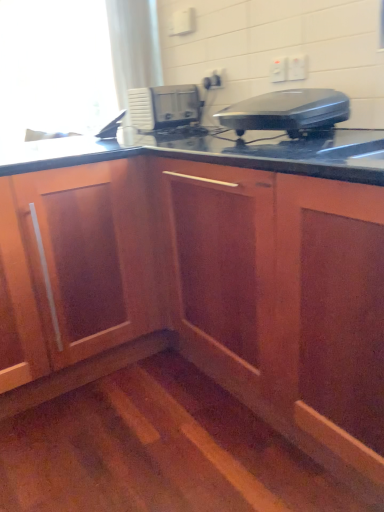
Question: Does white plastic electric outlet at upper right, the first electric outlet viewed from the front, appear on the left side of black plastic toaster at upper right, which appears as the 2th home appliance when viewed from the top?

Choices:
 (A) yes
 (B) no

Answer: (B)

Question: Would you consider white plastic electric outlet at upper right, the third electric outlet when ordered from back to front, to be distant from black plastic toaster at upper right, which ranks as the 2th home appliance in back-to-front order?

Choices:
 (A) no
 (B) yes

Answer: (A)

Question: Considering the relative positions of white plastic electric outlet at upper right, the first electric outlet viewed from the front, and black plastic toaster at upper right, which appears as the 2th home appliance when viewed from the top, in the image provided, is white plastic electric outlet at upper right, the first electric outlet viewed from the front, to the right of black plastic toaster at upper right, which appears as the 2th home appliance when viewed from the top, from the viewer's perspective?

Choices:
 (A) yes
 (B) no

Answer: (A)

Question: Is white plastic electric outlet at upper right, the 3th electric outlet from the left, smaller than black plastic toaster at upper right, which is the first home appliance in front-to-back order?

Choices:
 (A) no
 (B) yes

Answer: (B)

Question: From a real-world perspective, is white plastic electric outlet at upper right, the 3th electric outlet from the left, located higher than black plastic toaster at upper right, which ranks as the 2th home appliance in back-to-front order?

Choices:
 (A) no
 (B) yes

Answer: (B)

Question: Considering the relative positions of white plastic electric outlet at upper right, the first electric outlet viewed from the right, and black plastic toaster at upper right, which appears as the 2th home appliance when viewed from the top, in the image provided, is white plastic electric outlet at upper right, the first electric outlet viewed from the right, in front of black plastic toaster at upper right, which appears as the 2th home appliance when viewed from the top,?

Choices:
 (A) no
 (B) yes

Answer: (A)

Question: From the image's perspective, is wooden cabinet at center below black plastic toaster at upper right, which appears as the 2th home appliance when viewed from the left?

Choices:
 (A) yes
 (B) no

Answer: (A)

Question: Is wooden cabinet at center thinner than black plastic toaster at upper right, which appears as the 2th home appliance when viewed from the left?

Choices:
 (A) yes
 (B) no

Answer: (B)

Question: From a real-world perspective, does wooden cabinet at center sit lower than black plastic toaster at upper right, which appears as the 2th home appliance when viewed from the left?

Choices:
 (A) no
 (B) yes

Answer: (B)

Question: Is wooden cabinet at center far from black plastic toaster at upper right, which ranks as the 2th home appliance in back-to-front order?

Choices:
 (A) no
 (B) yes

Answer: (A)

Question: Considering the relative sizes of wooden cabinet at center and black plastic toaster at upper right, which is counted as the 1th home appliance, starting from the bottom, in the image provided, is wooden cabinet at center smaller than black plastic toaster at upper right, which is counted as the 1th home appliance, starting from the bottom,?

Choices:
 (A) no
 (B) yes

Answer: (A)

Question: Is wooden cabinet at center at the right side of black plastic toaster at upper right, which is the 1th home appliance from right to left?

Choices:
 (A) no
 (B) yes

Answer: (A)

Question: Is white plastic microwave at center, which is counted as the second home appliance, starting from the bottom, taller than white plastic electric outlet at upper right, the first electric outlet viewed from the front?

Choices:
 (A) yes
 (B) no

Answer: (A)